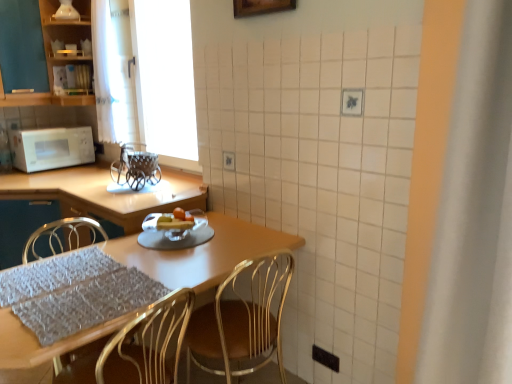
Question: Considering the positions of matte black cabinet at upper left and translucent glass fruit dish at center in the image, is matte black cabinet at upper left bigger or smaller than translucent glass fruit dish at center?

Choices:
 (A) small
 (B) big

Answer: (B)

Question: Would you say matte black cabinet at upper left is inside or outside translucent glass fruit dish at center?

Choices:
 (A) inside
 (B) outside

Answer: (B)

Question: Based on their relative distances, which object is farther from the translucent glass fruit dish at center?

Choices:
 (A) metallic gold chair at center
 (B) matte black cabinet at upper left
 (C) white matte microwave oven at left
 (D) gray textured placemat at lower left
 (E) wooden table at center

Answer: (B)

Question: Based on their relative distances, which object is farther from the white matte microwave oven at left?

Choices:
 (A) metallic basket at center
 (B) translucent glass fruit dish at center
 (C) wooden table at center
 (D) gray textured placemat at lower left
 (E) matte black cabinet at upper left

Answer: (D)